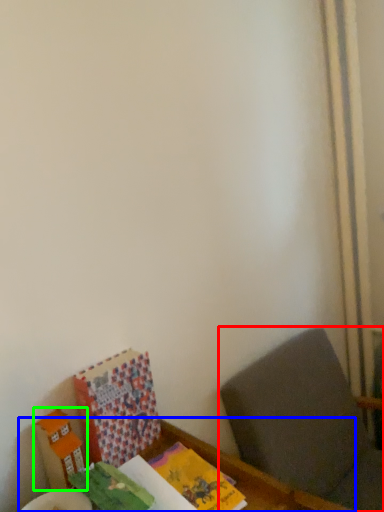
Question: Based on their relative distances, which object is farther from furniture (highlighted by a red box)? Choose from table (highlighted by a blue box) and cardboard box (highlighted by a green box).

Choices:
 (A) table
 (B) cardboard box

Answer: (B)